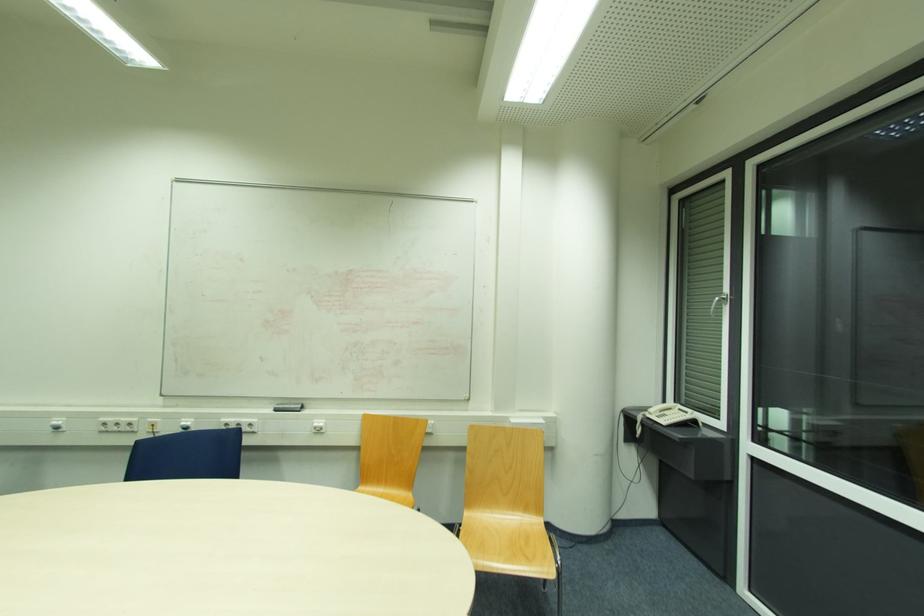
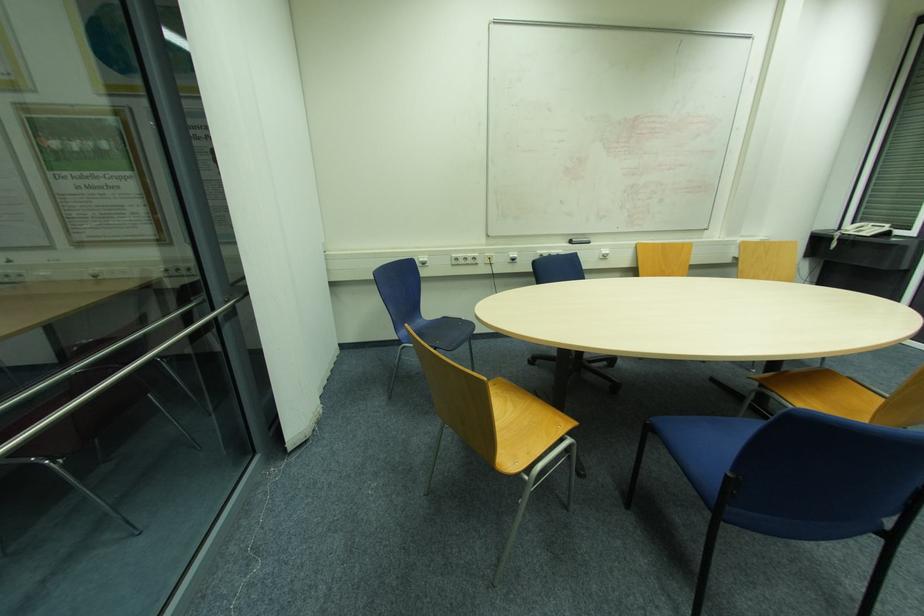
In the second image, find the point that corresponds to point 665,422 in the first image.

(869, 233)